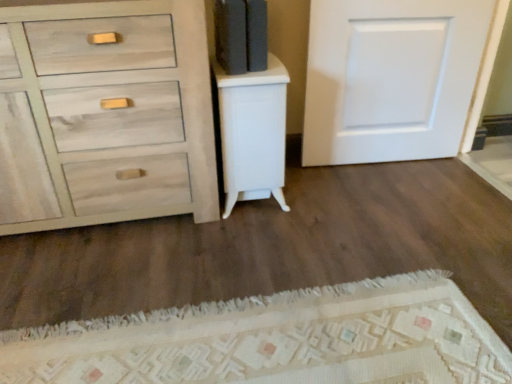
What do you see at coordinates (105, 115) in the screenshot?
I see `light gray wood dresser at left` at bounding box center [105, 115].

Image resolution: width=512 pixels, height=384 pixels. What are the coordinates of `light gray wood dresser at left` in the screenshot? It's located at (105, 115).

From the image's perspective, is light gray wood dresser at left positioned above or below white glossy cabinet at center?

light gray wood dresser at left is situated higher than white glossy cabinet at center in the image.

In terms of size, does light gray wood dresser at left appear bigger or smaller than white glossy cabinet at center?

Considering their sizes, light gray wood dresser at left takes up more space than white glossy cabinet at center.

Is the surface of light gray wood dresser at left in direct contact with white glossy cabinet at center?

No, light gray wood dresser at left is not next to white glossy cabinet at center.

From the image's perspective, between white glossy cabinet at center and light gray wood dresser at left, which one is located above?

light gray wood dresser at left.

Between white glossy cabinet at center and light gray wood dresser at left, which one has smaller size?

white glossy cabinet at center.

Which of these two, white matte door at upper right or light gray wood dresser at left, stands shorter?

white matte door at upper right is shorter.

Is light gray wood dresser at left located within white matte door at upper right?

No, light gray wood dresser at left is located outside of white matte door at upper right.

Between white matte door at upper right and light gray wood dresser at left, which one has smaller width?

With smaller width is white matte door at upper right.

From the image's perspective, is white matte door at upper right on top of light gray wood dresser at left?

Yes.

Does white glossy cabinet at center have a greater width compared to white matte door at upper right?

Correct, the width of white glossy cabinet at center exceeds that of white matte door at upper right.

Which is more to the right, white glossy cabinet at center or white matte door at upper right?

Positioned to the right is white matte door at upper right.

From a real-world perspective, which object stands above the other?

white matte door at upper right.

Which object is more forward, white glossy cabinet at center or white matte door at upper right?

white glossy cabinet at center is more forward.

Between white matte door at upper right and white glossy cabinet at center, which one appears on the left side from the viewer's perspective?

Positioned to the left is white glossy cabinet at center.

From a real-world perspective, is white matte door at upper right positioned above or below white glossy cabinet at center?

From a real-world perspective, white matte door at upper right is physically above white glossy cabinet at center.

Where is `vanity below the white matte door at upper right (from a real-world perspective)`? vanity below the white matte door at upper right (from a real-world perspective) is located at coordinates (253, 133).

Can you confirm if white matte door at upper right is thinner than white glossy cabinet at center?

Yes, white matte door at upper right is thinner than white glossy cabinet at center.

Considering the positions of point (139, 169) and point (439, 70), is point (139, 169) closer or farther from the camera than point (439, 70)?

Point (139, 169) is closer to the camera than point (439, 70).

Considering the sizes of light gray wood dresser at left and white matte door at upper right in the image, is light gray wood dresser at left bigger or smaller than white matte door at upper right?

Clearly, light gray wood dresser at left is larger in size than white matte door at upper right.

In the scene shown: Does light gray wood dresser at left turn towards white matte door at upper right?

No, light gray wood dresser at left is not turned towards white matte door at upper right.

Locate an element on the screen. The image size is (512, 384). chest of drawers that appears on the left of white glossy cabinet at center is located at coordinates (105, 115).

I want to click on vanity below the light gray wood dresser at left (from a real-world perspective), so click(x=253, y=133).

Looking at the image, which one is located further to white matte door at upper right, light gray wood dresser at left or white glossy cabinet at center?

light gray wood dresser at left.

From the picture: Based on their spatial positions, is white glossy cabinet at center or white matte door at upper right closer to light gray wood dresser at left?

Among the two, white glossy cabinet at center is located nearer to light gray wood dresser at left.

When comparing their distances from white glossy cabinet at center, does white matte door at upper right or light gray wood dresser at left seem closer?

The object closer to white glossy cabinet at center is light gray wood dresser at left.

When comparing their distances from light gray wood dresser at left, does white matte door at upper right or white glossy cabinet at center seem further?

white matte door at upper right is further to light gray wood dresser at left.

Based on their spatial positions, is light gray wood dresser at left or white matte door at upper right closer to white glossy cabinet at center?

Based on the image, light gray wood dresser at left appears to be nearer to white glossy cabinet at center.

When comparing their distances from white matte door at upper right, does white glossy cabinet at center or light gray wood dresser at left seem further?

light gray wood dresser at left is positioned further to the anchor white matte door at upper right.

Find the location of a particular element. This screenshot has height=384, width=512. vanity located between light gray wood dresser at left and white matte door at upper right in the left-right direction is located at coordinates (253, 133).